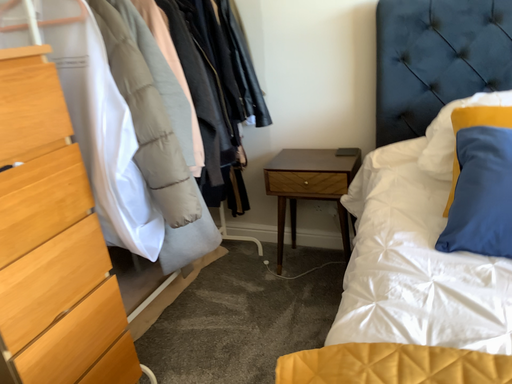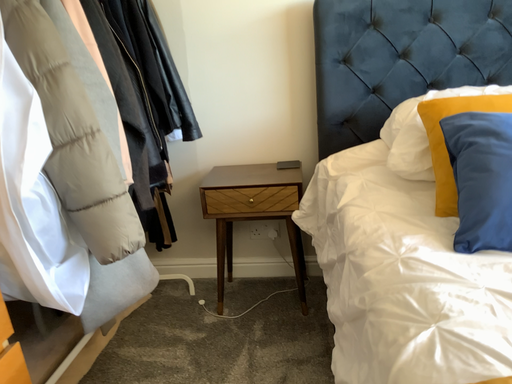
Question: Which way did the camera rotate in the video?

Choices:
 (A) rotated right
 (B) rotated left

Answer: (A)